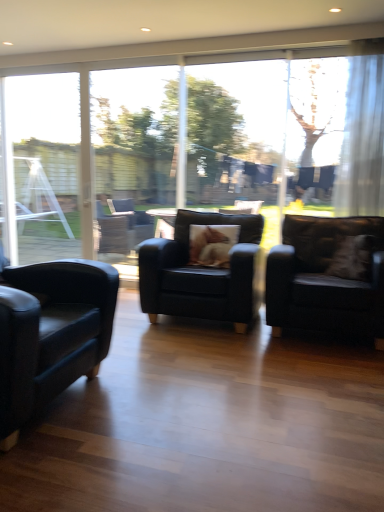
Question: Is transparent glass screen door at center wider or thinner than matte black armchair at right, the 1th chair in the right-to-left sequence?

Choices:
 (A) wide
 (B) thin

Answer: (B)

Question: Considering their positions, is transparent glass screen door at center located in front of or behind matte black armchair at right, the 1th chair in the right-to-left sequence?

Choices:
 (A) front
 (B) behind

Answer: (B)

Question: Estimate the real-world distances between objects in this image. Which object is farther from the matte black armchair at left, placed as the first chair when sorted from left to right?

Choices:
 (A) matte black armchair at center, the second chair from the right
 (B) matte black armchair at right, which is the 3th chair from left to right
 (C) velvet beige pillow at right
 (D) brown furry pillow at center
 (E) transparent glass screen door at center

Answer: (E)

Question: Considering the real-world distances, which object is farthest from the transparent glass screen door at center?

Choices:
 (A) velvet beige pillow at right
 (B) matte black armchair at center, arranged as the second chair when viewed from the left
 (C) clear glass window frame at left
 (D) white sheer curtain at upper right
 (E) matte black armchair at left, placed as the first chair when sorted from left to right

Answer: (E)